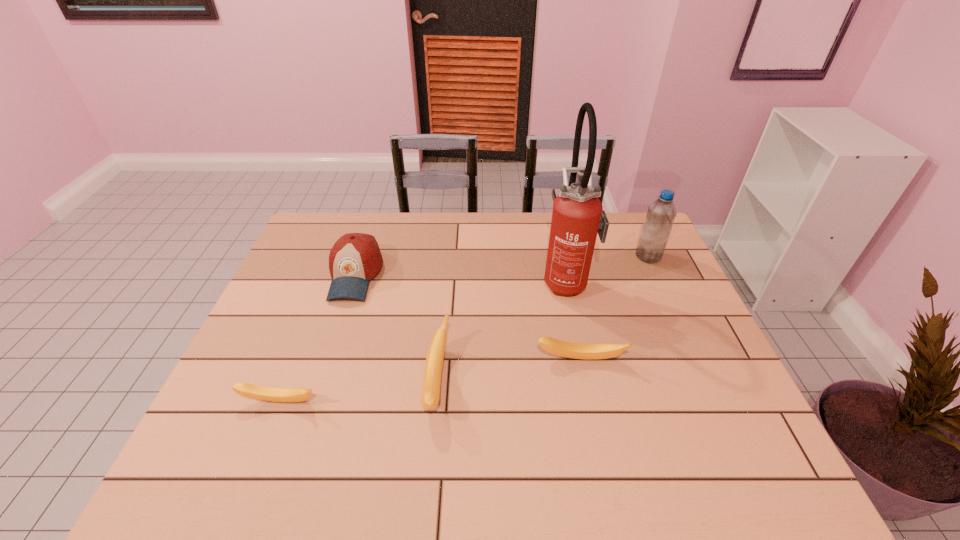
Locate an element on the screen. Image resolution: width=960 pixels, height=540 pixels. the shortest object is located at coordinates (252, 391).

You are a GUI agent. You are given a task and a screenshot of the screen. Output one action in this format:
    pyautogui.click(x=<x>, y=<y>)
    Task: Click on the shortest banana
    This screenshot has width=960, height=540.
    Given the screenshot: What is the action you would take?
    pyautogui.click(x=252, y=391)

The height and width of the screenshot is (540, 960). In order to click on the second banana from left to right in this screenshot , I will do `click(430, 394)`.

Where is `the second shortest banana`? The image size is (960, 540). the second shortest banana is located at coordinates click(557, 347).

Identify the location of the fifth tallest object. This screenshot has width=960, height=540. (557, 347).

You are a GUI agent. You are given a task and a screenshot of the screen. Output one action in this format:
    pyautogui.click(x=<x>, y=<y>)
    Task: Click on the fourth shortest object
    The image size is (960, 540).
    Given the screenshot: What is the action you would take?
    pyautogui.click(x=355, y=258)

You are a GUI agent. You are given a task and a screenshot of the screen. Output one action in this format:
    pyautogui.click(x=<x>, y=<y>)
    Task: Click on the tallest object
    This screenshot has height=540, width=960.
    Given the screenshot: What is the action you would take?
    pyautogui.click(x=578, y=214)

The image size is (960, 540). Find the location of `the rightmost object`. the rightmost object is located at coordinates (661, 214).

Locate an element on the screen. water bottle is located at coordinates tap(661, 214).

This screenshot has height=540, width=960. I want to click on free point located at the stem of the second banana from right to left, so click(x=541, y=380).